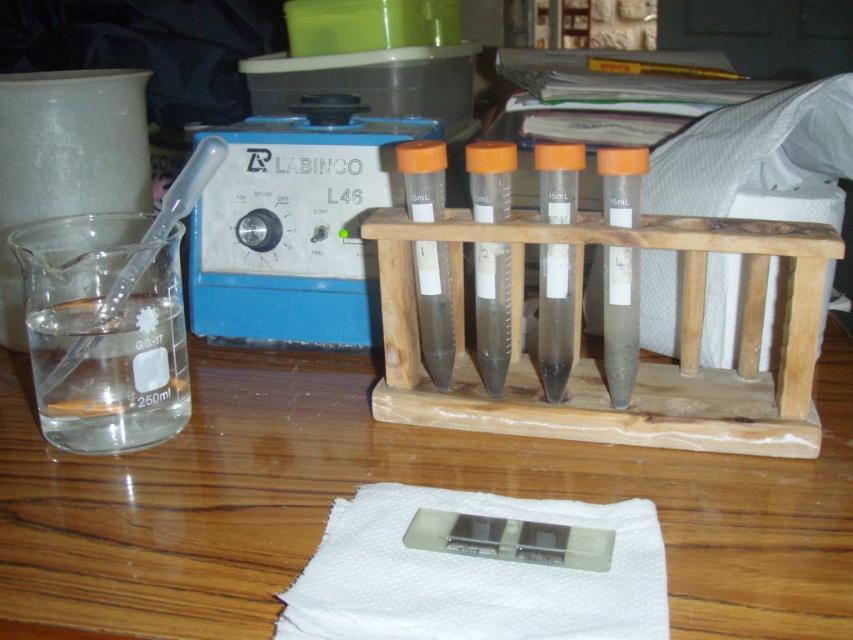
You are a lab assistant who needs to place a 30cm tall cylinder on the wooden table at center. The transparent glass beaker at left is currently occupying some space. Can the cylinder be placed on the table without moving the beaker?

The wooden table at center has a larger size compared to the transparent glass beaker at left, so there is enough space to place the 30cm tall cylinder on the wooden table at center without moving the beaker.

You are a lab assistant who needs to store the transparent glass beaker at left and the transparent wood test tube rack at center in a drawer. The drawer has a height limit of 12 inches. Can both items fit vertically without exceeding the height limit?

The transparent wood test tube rack at center is bigger than the transparent glass beaker at left. Since the test tube rack is larger, it might exceed the 12 inch height limit. You should measure both items to confirm their heights before storing them vertically in the drawer.

You are a lab assistant who needs to place a large equipment box on the wooden table at center without covering the transparent wood test tube rack at center. Can you fit the box on the table?

The wooden table at center has a larger size compared to transparent wood test tube rack at center, so yes, the box can be placed on the wooden table at center without covering the test tube rack since there is enough space available.